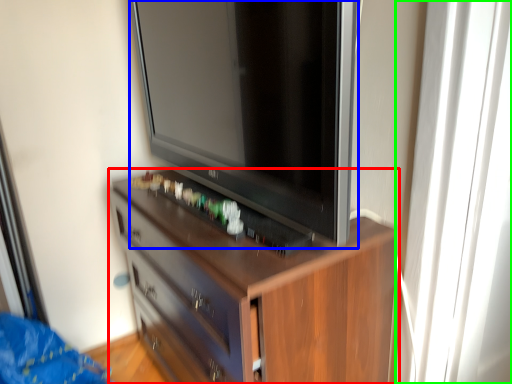
Question: Estimate the real-world distances between objects in this image. Which object is closer to chest of drawers (highlighted by a red box), television (highlighted by a blue box) or glass door (highlighted by a green box)?

Choices:
 (A) television
 (B) glass door

Answer: (A)